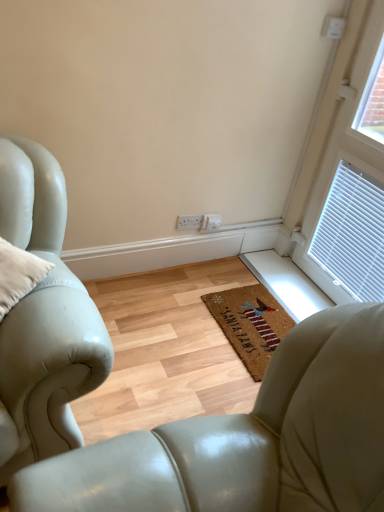
Where is `leather armchair at center`? leather armchair at center is located at coordinates (248, 439).

Which is more to the left, coir mat at center or white plastic window at upper right?

From the viewer's perspective, coir mat at center appears more on the left side.

Is point (267, 323) positioned after point (367, 87)?

That is True.

Considering the relative sizes of coir mat at center and white plastic window at upper right in the image provided, is coir mat at center smaller than white plastic window at upper right?

Correct, coir mat at center occupies less space than white plastic window at upper right.

From a real-world perspective, is coir mat at center physically located above or below white plastic window at upper right?

coir mat at center is situated lower than white plastic window at upper right in the real world.

From a real-world perspective, between leather armchair at center and white plastic window at upper right, who is vertically higher?

white plastic window at upper right, from a real-world perspective.

From the image's perspective, is leather armchair at center positioned above or below white plastic window at upper right?

leather armchair at center is situated lower than white plastic window at upper right in the image.

Is leather armchair at center not near white plastic window at upper right?

Yes, leather armchair at center is far from white plastic window at upper right.

Looking at this image, in terms of size, does leather armchair at center appear bigger or smaller than white plastic window at upper right?

leather armchair at center is smaller than white plastic window at upper right.

Is coir mat at center closer to the viewer compared to leather armchair at center?

No, coir mat at center is further to the viewer.

How different are the orientations of coir mat at center and leather armchair at center in degrees?

They differ by 180 degrees in their facing directions.

Looking at this image, does coir mat at center have a smaller size compared to leather armchair at center?

Yes, coir mat at center is smaller than leather armchair at center.

Is leather armchair at center a part of white plastic window at upper right?

No, leather armchair at center is located outside of white plastic window at upper right.

The height and width of the screenshot is (512, 384). I want to click on chair beneath the white plastic window at upper right (from a real-world perspective), so click(x=248, y=439).

Is white plastic window at upper right to the right of leather armchair at center from the viewer's perspective?

Correct, you'll find white plastic window at upper right to the right of leather armchair at center.

From the image's perspective, is white plastic window at upper right beneath leather armchair at center?

No.

From a real-world perspective, is leather armchair at center positioned above or below coir mat at center?

leather armchair at center is situated lower than coir mat at center in the real world.

Looking at this image, from the image's perspective, is leather armchair at center located beneath coir mat at center?

Yes.

Which of these two, leather armchair at center or coir mat at center, is wider?

Wider between the two is leather armchair at center.

Does leather armchair at center appear on the left side of coir mat at center?

Indeed, leather armchair at center is positioned on the left side of coir mat at center.

From the image's perspective, who appears lower, white plastic window at upper right or coir mat at center?

coir mat at center is shown below in the image.

What's the angular difference between white plastic window at upper right and coir mat at center's facing directions?

There is a 0.00172-degree angle between the facing directions of white plastic window at upper right and coir mat at center.

Which point is more forward, (380, 49) or (228, 312)?

The point (380, 49) is more forward.

Choose the correct answer: Is white plastic window at upper right inside coir mat at center or outside it?

white plastic window at upper right cannot be found inside coir mat at center.

Locate an element on the screen. This screenshot has height=512, width=384. mat behind the white plastic window at upper right is located at coordinates (250, 324).

Identify the location of chair that is below the white plastic window at upper right (from the image's perspective). This screenshot has width=384, height=512. (248, 439).

Estimate the real-world distances between objects in this image. Which object is further from white plastic window at upper right, leather armchair at center or coir mat at center?

leather armchair at center.

When comparing their distances from leather armchair at center, does coir mat at center or white plastic window at upper right seem further?

white plastic window at upper right is further to leather armchair at center.

When comparing their distances from coir mat at center, does white plastic window at upper right or leather armchair at center seem closer?

white plastic window at upper right.

Looking at the image, which one is located closer to leather armchair at center, white plastic window at upper right or coir mat at center?

coir mat at center is closer to leather armchair at center.

From the image, which object appears to be nearer to white plastic window at upper right, coir mat at center or leather armchair at center?

Based on the image, coir mat at center appears to be nearer to white plastic window at upper right.

Considering their positions, is leather armchair at center positioned closer to coir mat at center than white plastic window at upper right?

white plastic window at upper right is positioned closer to the anchor coir mat at center.

Where is `mat located between leather armchair at center and white plastic window at upper right in the left-right direction`? This screenshot has width=384, height=512. mat located between leather armchair at center and white plastic window at upper right in the left-right direction is located at coordinates (250, 324).